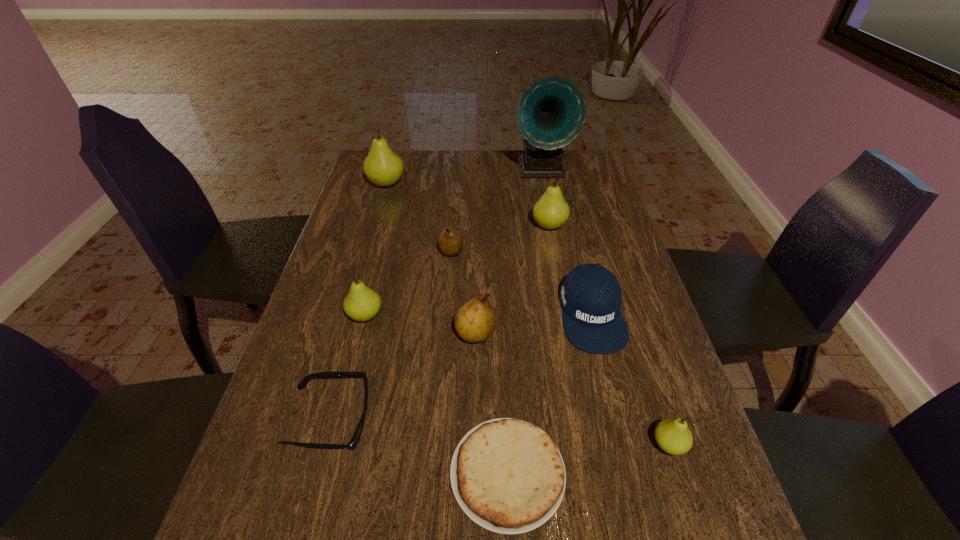
At what (x,y) coordinates should I click in order to perform the action: click on object that is positioned at the far left corner. Please return your answer as a coordinate pair (x, y). Image resolution: width=960 pixels, height=540 pixels. Looking at the image, I should click on (383, 167).

The height and width of the screenshot is (540, 960). In order to click on object that is at the far right corner in this screenshot , I will do `click(551, 112)`.

Image resolution: width=960 pixels, height=540 pixels. I want to click on free region at the far edge of the desktop, so click(x=407, y=176).

I want to click on free space at the left edge, so click(340, 235).

In the image, there is a desktop. Where is `free space at the right edge`? This screenshot has height=540, width=960. free space at the right edge is located at coordinates (578, 185).

In order to click on free region at the far left corner of the desktop in this screenshot , I will do `click(396, 151)`.

You are a GUI agent. You are given a task and a screenshot of the screen. Output one action in this format:
    pyautogui.click(x=<x>, y=<y>)
    Task: Click on the free space at the far right corner of the desktop
    The width and height of the screenshot is (960, 540).
    Given the screenshot: What is the action you would take?
    pyautogui.click(x=564, y=155)

Identify the location of free spot between the fourth nearest pear and the fifth shortest pear. (x=500, y=239).

Identify the location of vacant space that is in between the nearest green pear and the second smallest green pear. This screenshot has width=960, height=540. (517, 380).

Where is `unoccupied position between the rightmost pear and the tallest pear`? unoccupied position between the rightmost pear and the tallest pear is located at coordinates (528, 314).